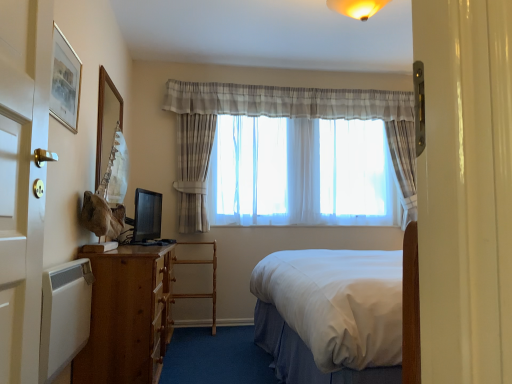
The image size is (512, 384). Find the location of `sheer fabric curtain at center`. sheer fabric curtain at center is located at coordinates (282, 116).

Where is `white matte radiator at lower left`? The height and width of the screenshot is (384, 512). white matte radiator at lower left is located at coordinates (64, 316).

The height and width of the screenshot is (384, 512). I want to click on translucent fabric curtain at center, so (302, 173).

Locate an element on the screen. This screenshot has width=512, height=384. wooden picture frame at upper left, acting as the first picture frame starting from the back is located at coordinates (106, 122).

You are a GUI agent. You are given a task and a screenshot of the screen. Output one action in this format:
    pyautogui.click(x=<x>, y=<y>)
    Task: Click on the television lying above the brown wooden desk at left (from the image's perspective)
    
    Given the screenshot: What is the action you would take?
    pyautogui.click(x=147, y=215)

Can you confirm if matte black monitor at left is thinner than brown wooden desk at left?

Correct, the width of matte black monitor at left is less than that of brown wooden desk at left.

Which is behind, point (134, 224) or point (92, 252)?

The point (134, 224) is farther.

Identify the location of television lying on the right of wooden picture frame at upper left, acting as the first picture frame starting from the back. This screenshot has height=384, width=512. (147, 215).

In terms of height, does matte black monitor at left look taller or shorter compared to wooden picture frame at upper left, arranged as the 1th picture frame when viewed from the left?

Considering their sizes, matte black monitor at left has less height than wooden picture frame at upper left, arranged as the 1th picture frame when viewed from the left.

Which of these two, matte black monitor at left or wooden picture frame at upper left, acting as the first picture frame starting from the back, is thinner?

wooden picture frame at upper left, acting as the first picture frame starting from the back, is thinner.

Does matte black monitor at left appear on the right side of wooden picture frame at upper left, placed as the second picture frame when sorted from front to back?

Correct, you'll find matte black monitor at left to the right of wooden picture frame at upper left, placed as the second picture frame when sorted from front to back.

Considering the sizes of objects wooden ladder at center and brown wooden desk at left in the image provided, who is bigger, wooden ladder at center or brown wooden desk at left?

With larger size is brown wooden desk at left.

Is wooden ladder at center oriented towards brown wooden desk at left?

Yes, wooden ladder at center faces towards brown wooden desk at left.

Is wooden ladder at center with brown wooden desk at left?

No, wooden ladder at center is not next to brown wooden desk at left.

How distant is wooden ladder at center from brown wooden desk at left?

wooden ladder at center is 4.66 feet from brown wooden desk at left.

Who is taller, wooden ladder at center or white matte radiator at lower left?

wooden ladder at center is taller.

From the image's perspective, is wooden ladder at center located above or below white matte radiator at lower left?

Clearly, from the image's perspective, wooden ladder at center is below white matte radiator at lower left.

Is wooden ladder at center facing towards white matte radiator at lower left?

Yes, wooden ladder at center is oriented towards white matte radiator at lower left.

From the image's perspective, is wooden picture frame at upper left, acting as the first picture frame starting from the back, under white matte radiator at lower left?

No.

Considering the relative positions of wooden picture frame at upper left, placed as the second picture frame when sorted from front to back, and white matte radiator at lower left in the image provided, is wooden picture frame at upper left, placed as the second picture frame when sorted from front to back, to the left or to the right of white matte radiator at lower left?

Result: wooden picture frame at upper left, placed as the second picture frame when sorted from front to back, is positioned on white matte radiator at lower left's left side.

Is wooden picture frame at upper left, arranged as the 1th picture frame when viewed from the left, bigger than white matte radiator at lower left?

Yes.

I want to click on picture frame that is the 1st object to the left of the translucent fabric curtain at center, starting at the anchor, so click(65, 82).

From a real-world perspective, who is located lower, gold-framed picture at upper left, arranged as the second picture frame when viewed from the back, or translucent fabric curtain at center?

translucent fabric curtain at center, from a real-world perspective.

Which point is more forward, (53, 59) or (366, 176)?

The point (53, 59) is more forward.

Can you confirm if wooden ladder at center is shorter than wooden picture frame at upper left, arranged as the 1th picture frame when viewed from the left?

Yes, wooden ladder at center is shorter than wooden picture frame at upper left, arranged as the 1th picture frame when viewed from the left.

Is wooden ladder at center looking in the opposite direction of wooden picture frame at upper left, arranged as the 2th picture frame when viewed from the right?

No, wooden ladder at center's orientation is not away from wooden picture frame at upper left, arranged as the 2th picture frame when viewed from the right.

Between wooden ladder at center and wooden picture frame at upper left, arranged as the 2th picture frame when viewed from the right, which one appears on the right side from the viewer's perspective?

wooden ladder at center.

From the image's perspective, which is below, wooden ladder at center or wooden picture frame at upper left, acting as the first picture frame starting from the back?

wooden ladder at center.

At what (x,y) coordinates should I click in order to perform the action: click on desk below the matte black monitor at left (from the image's perspective). Please return your answer as a coordinate pair (x, y). The width and height of the screenshot is (512, 384). Looking at the image, I should click on (126, 316).

At what (x,y) coordinates should I click in order to perform the action: click on television that appears behind the wooden picture frame at upper left, acting as the first picture frame starting from the back. Please return your answer as a coordinate pair (x, y). Looking at the image, I should click on (147, 215).

From the image, which object appears to be nearer to gold-framed picture at upper left, arranged as the second picture frame when viewed from the back, brown wooden desk at left or sheer fabric curtain at center?

brown wooden desk at left.

Considering their positions, is white matte radiator at lower left positioned closer to wooden ladder at center than brown wooden desk at left?

Among the two, brown wooden desk at left is located nearer to wooden ladder at center.

In the scene shown: Estimate the real-world distances between objects in this image. Which object is further from wooden ladder at center, wooden picture frame at upper left, arranged as the 2th picture frame when viewed from the right, or translucent fabric curtain at center?

wooden picture frame at upper left, arranged as the 2th picture frame when viewed from the right, is further to wooden ladder at center.

Based on the photo, which object lies nearer to the anchor point gold-framed picture at upper left, placed as the second picture frame when sorted from left to right, white matte radiator at lower left or wooden picture frame at upper left, placed as the second picture frame when sorted from front to back?

wooden picture frame at upper left, placed as the second picture frame when sorted from front to back, lies closer to gold-framed picture at upper left, placed as the second picture frame when sorted from left to right, than the other object.

When comparing their distances from matte black monitor at left, does wooden ladder at center or brown wooden desk at left seem further?

brown wooden desk at left is further to matte black monitor at left.

Based on their spatial positions, is gold-framed picture at upper left, which is the first picture frame from right to left, or white matte radiator at lower left closer to sheer fabric curtain at center?

gold-framed picture at upper left, which is the first picture frame from right to left.

Consider the image. From the image, which object appears to be nearer to wooden picture frame at upper left, arranged as the 1th picture frame when viewed from the left, gold-framed picture at upper left, arranged as the second picture frame when viewed from the back, or translucent fabric curtain at center?

gold-framed picture at upper left, arranged as the second picture frame when viewed from the back, is closer to wooden picture frame at upper left, arranged as the 1th picture frame when viewed from the left.

Which object lies nearer to the anchor point white matte radiator at lower left, wooden picture frame at upper left, arranged as the 2th picture frame when viewed from the right, or wooden ladder at center?

wooden picture frame at upper left, arranged as the 2th picture frame when viewed from the right.

The height and width of the screenshot is (384, 512). I want to click on armchair between gold-framed picture at upper left, placed as the second picture frame when sorted from left to right, and translucent fabric curtain at center in the front-back direction, so click(212, 279).

I want to click on curtain positioned between brown wooden desk at left and translucent fabric curtain at center from near to far, so click(x=282, y=116).

This screenshot has width=512, height=384. In order to click on television between wooden picture frame at upper left, acting as the first picture frame starting from the back, and sheer fabric curtain at center, in the horizontal direction in this screenshot , I will do `click(147, 215)`.

At what (x,y) coordinates should I click in order to perform the action: click on armchair between wooden picture frame at upper left, placed as the second picture frame when sorted from front to back, and translucent fabric curtain at center. Please return your answer as a coordinate pair (x, y). Looking at the image, I should click on (212, 279).